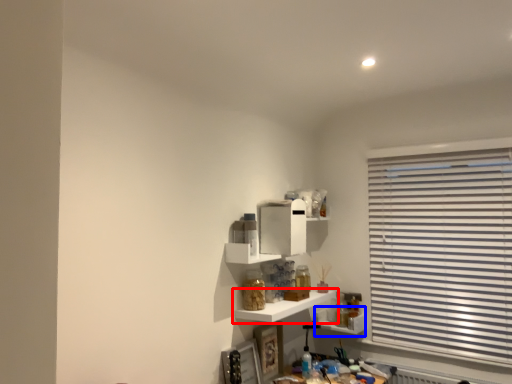
Question: Among these objects, which one is farthest to the camera, shelf (highlighted by a red box) or shelf (highlighted by a blue box)?

Choices:
 (A) shelf
 (B) shelf

Answer: (B)